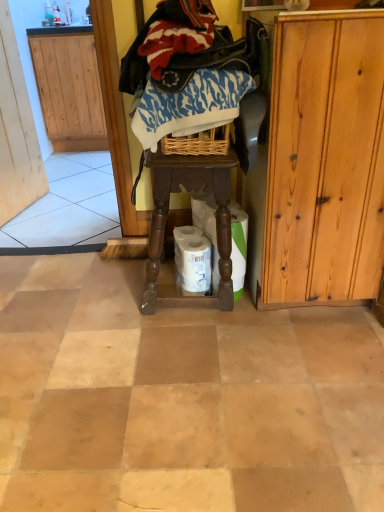
Question: Is brown wooden stool at center wider or thinner than light brown wood cabinet at right?

Choices:
 (A) wide
 (B) thin

Answer: (B)

Question: Does point (160, 256) appear closer or farther from the camera than point (296, 167)?

Choices:
 (A) closer
 (B) farther

Answer: (B)

Question: Which object is positioned farthest from the white matte toilet paper at center, acting as the 1th toilet paper starting from the right?

Choices:
 (A) blue printed fabric at center, which is the 2th clothing in top-to-bottom order
 (B) knitted wool sweater at upper center, placed as the first clothing when sorted from top to bottom
 (C) brown wooden stool at center
 (D) light brown wood cabinet at right
 (E) white matte toilet paper at center, which ranks as the second toilet paper in right-to-left order

Answer: (B)

Question: Estimate the real-world distances between objects in this image. Which object is farther from the white matte toilet paper at center, which ranks as the second toilet paper in right-to-left order?

Choices:
 (A) wooden screen door at left
 (B) knitted wool sweater at upper center, acting as the 2th clothing starting from the bottom
 (C) blue printed fabric at center, which is the 2th clothing in top-to-bottom order
 (D) white matte toilet paper at center, which is the second toilet paper from left to right
 (E) brown wooden stool at center

Answer: (A)